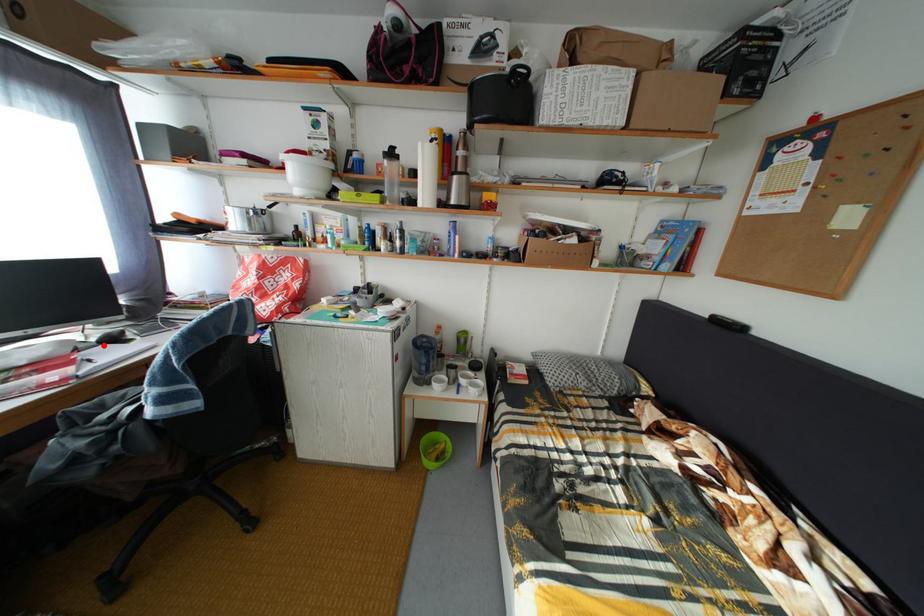
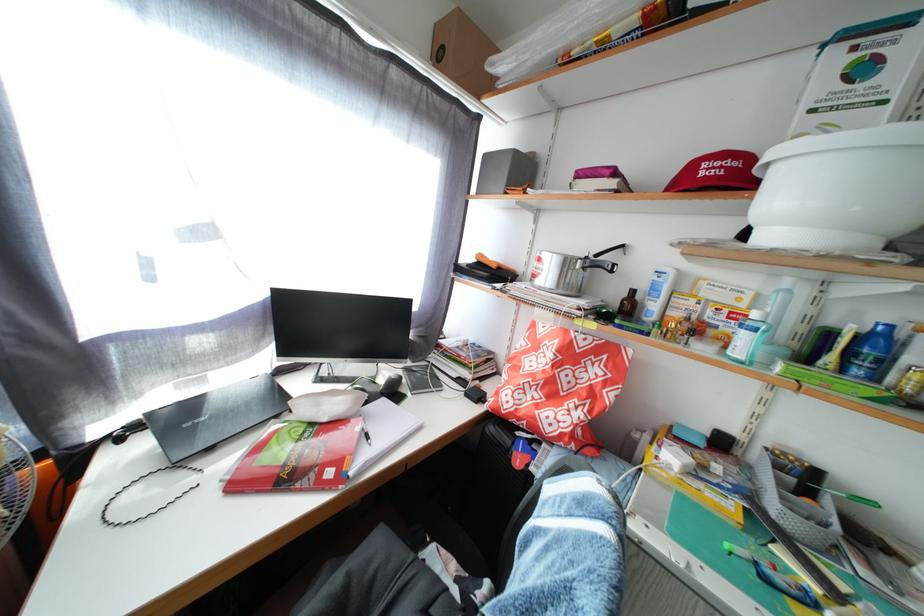
Where in the second image is the point corresponding to the highlighted location from the first image?

(390, 387)